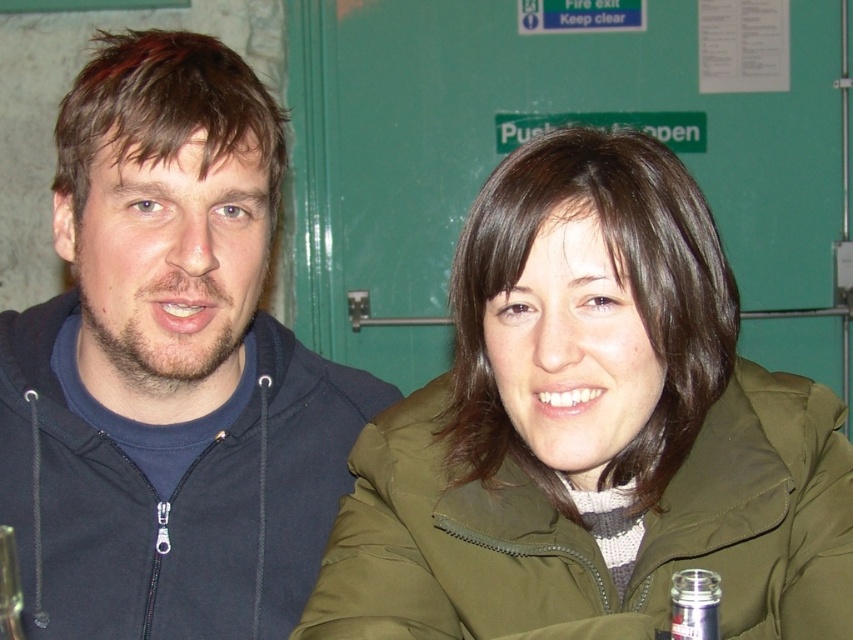
Question: Is clear glass bottle at center further to the viewer compared to clear plastic bottle at lower left?

Choices:
 (A) yes
 (B) no

Answer: (B)

Question: Among these points, which one is nearest to the camera?

Choices:
 (A) (0, 534)
 (B) (45, 461)
 (C) (718, 593)

Answer: (C)

Question: Where is olive-green jacket at center located in relation to dark blue hoodie at left in the image?

Choices:
 (A) right
 (B) left

Answer: (A)

Question: Estimate the real-world distances between objects in this image. Which object is closer to the olive-green jacket at center?

Choices:
 (A) clear glass bottle at center
 (B) clear plastic bottle at lower left

Answer: (A)

Question: Does dark blue hoodie at left have a smaller size compared to clear glass bottle at center?

Choices:
 (A) yes
 (B) no

Answer: (B)

Question: Which object is farther from the camera taking this photo?

Choices:
 (A) clear plastic bottle at lower left
 (B) clear glass bottle at center
 (C) dark blue hoodie at left
 (D) olive-green jacket at center

Answer: (C)